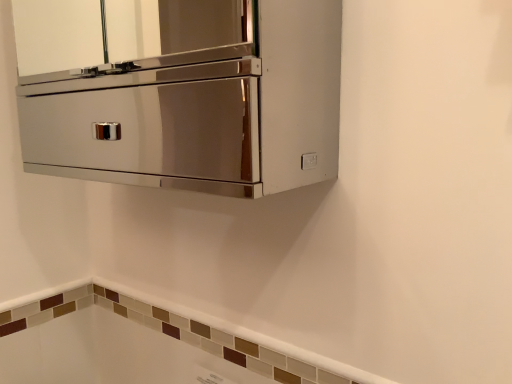
Where is `polished stainless steel cabinet at upper center`? Image resolution: width=512 pixels, height=384 pixels. polished stainless steel cabinet at upper center is located at coordinates (189, 98).

What do you see at coordinates (189, 98) in the screenshot?
I see `polished stainless steel cabinet at upper center` at bounding box center [189, 98].

Find the location of a particular element. polished stainless steel cabinet at upper center is located at coordinates (189, 98).